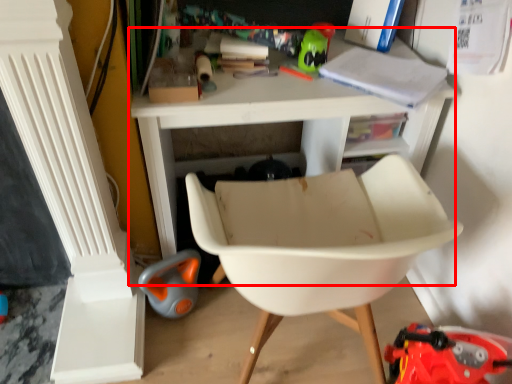
Question: From the image's perspective, what is the correct spatial relationship of table (annotated by the red box) in relation to chair?

Choices:
 (A) above
 (B) below

Answer: (A)